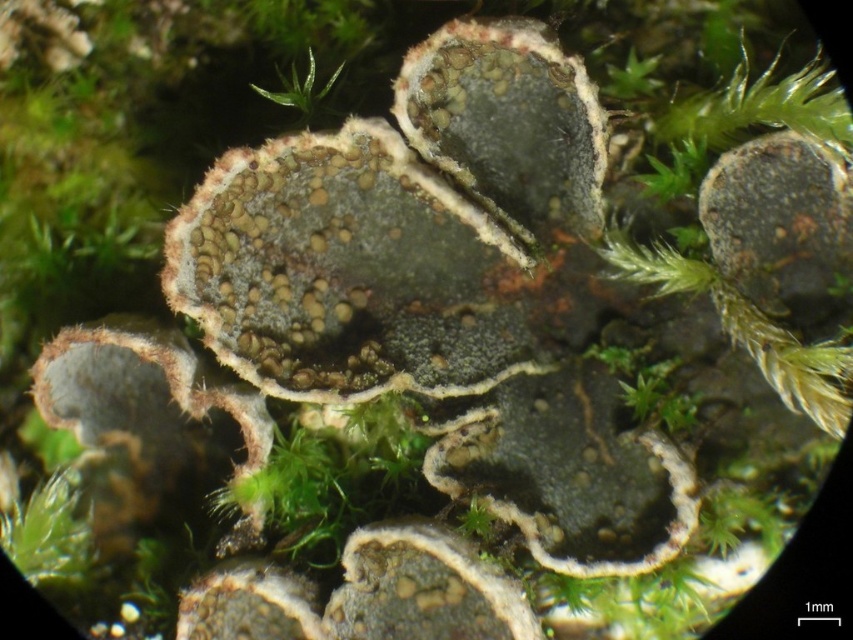
Question: Does dark gray textured lichen at center lie in front of speckled gray rock at center?

Choices:
 (A) no
 (B) yes

Answer: (B)

Question: Which point is farther from the camera taking this photo?

Choices:
 (A) (422, 534)
 (B) (564, 141)

Answer: (B)

Question: Can you confirm if speckled gray rock at center is positioned to the right of green fuzzy moss at upper center?

Choices:
 (A) yes
 (B) no

Answer: (A)

Question: Is matte gray lichen at upper right bigger than green fuzzy moss at upper center?

Choices:
 (A) yes
 (B) no

Answer: (A)

Question: Which of the following is the farthest from the observer?

Choices:
 (A) (849, 166)
 (B) (294, 97)
 (C) (599, 422)
 (D) (412, 88)

Answer: (C)

Question: Among these points, which one is nearest to the camera?

Choices:
 (A) (308, 99)
 (B) (409, 522)
 (C) (572, 141)

Answer: (A)